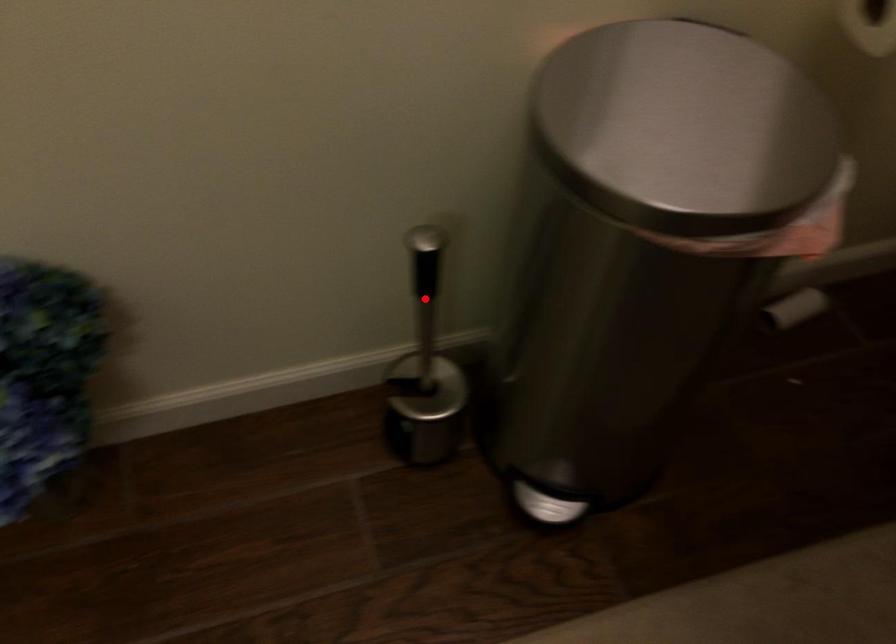
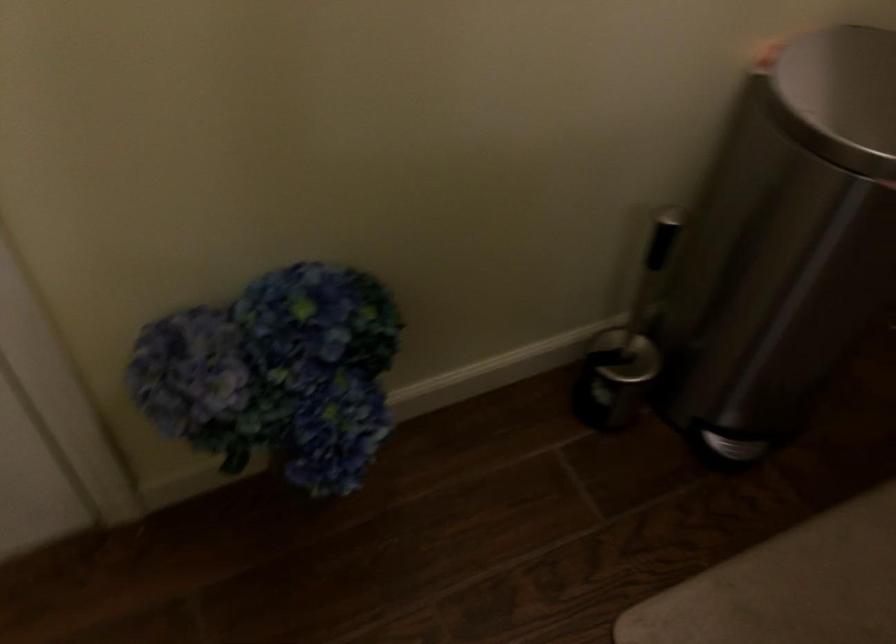
The point at the highlighted location is marked in the first image. Where is the corresponding point in the second image?

(650, 270)